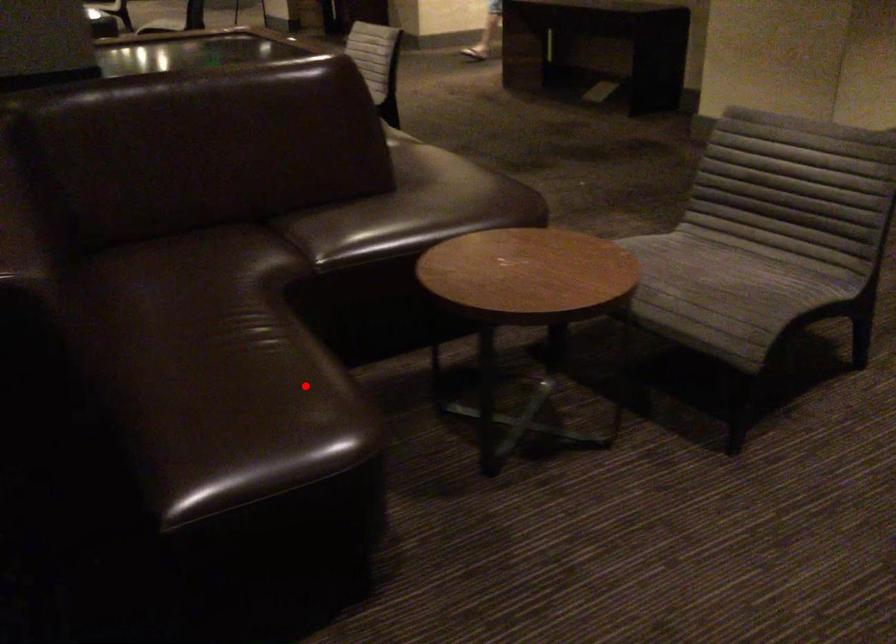
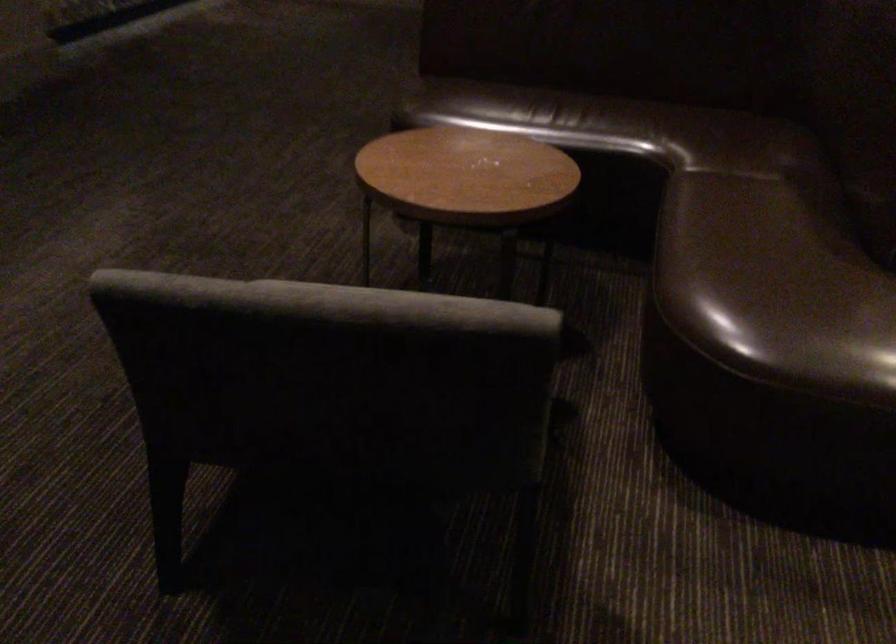
Find the pixel in the second image that matches the highlighted location in the first image.

(494, 108)